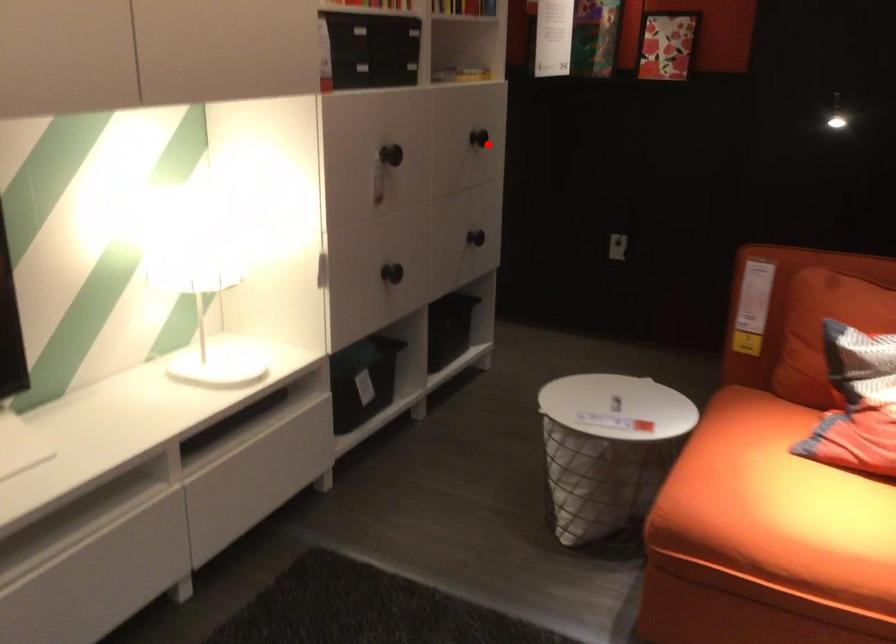
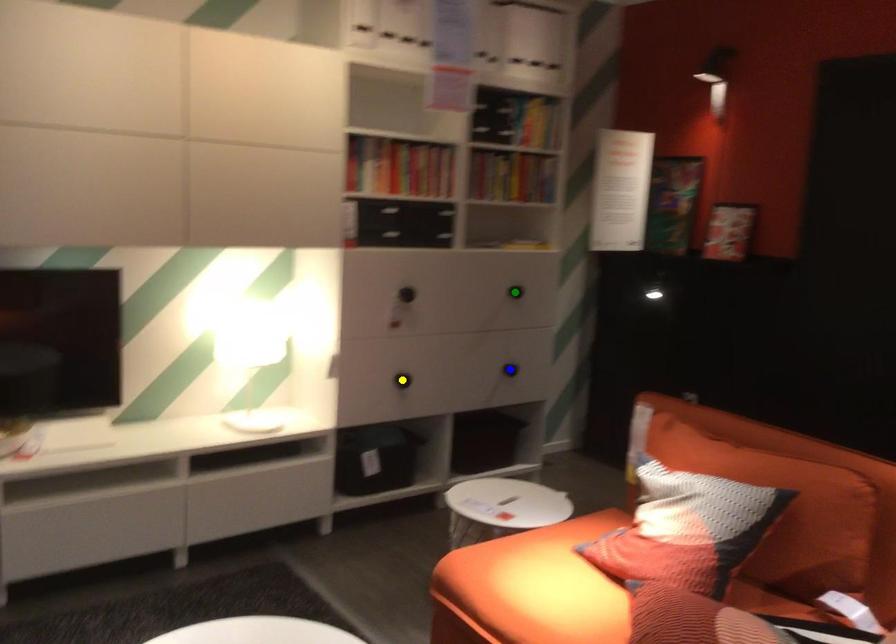
Question: I am providing you with two images of the same scene from different viewpoints. A red point is marked on the first image. You are given multiple points on the second image. Which point in image 2 is actually the same real-world point as the red point in image 1?

Choices:
 (A) green point
 (B) blue point
 (C) yellow point

Answer: (A)